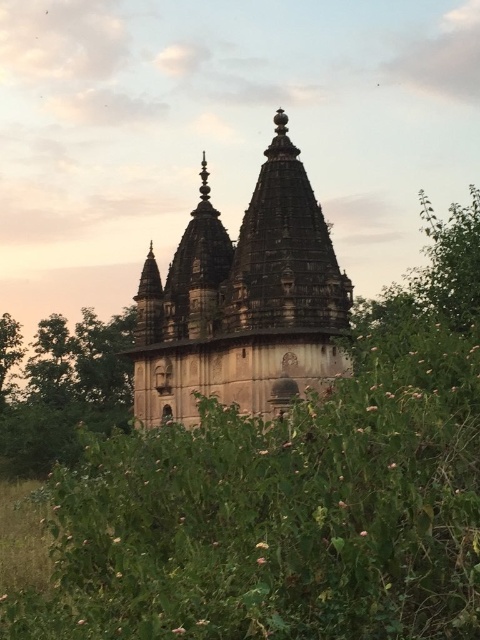
From the picture: Is stone hindu temple at center wider than green leafy tree at center?

Yes, stone hindu temple at center is wider than green leafy tree at center.

Between point (251, 352) and point (33, 428), which one is positioned in front?

Point (251, 352) is more forward.

Measure the distance between point (228, 280) and camera.

The distance of point (228, 280) from camera is 349.65 feet.

This screenshot has height=640, width=480. What are the coordinates of `stone hindu temple at center` in the screenshot? It's located at (242, 301).